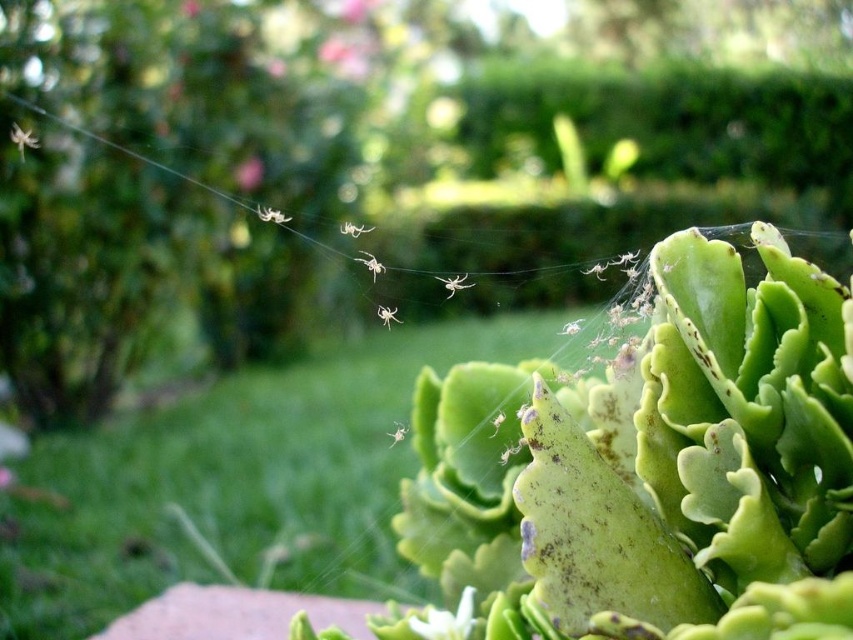
Is point (442, 636) closer to camera compared to point (247, 173)?

Yes, point (442, 636) is in front of point (247, 173).

Image resolution: width=853 pixels, height=640 pixels. Describe the element at coordinates (447, 620) in the screenshot. I see `white matte flower at lower center` at that location.

Where is `white matte flower at lower center`? white matte flower at lower center is located at coordinates (447, 620).

Is point (428, 628) closer to camera compared to point (277, 221)?

No, it is behind (277, 221).

The height and width of the screenshot is (640, 853). I want to click on white matte flower at lower center, so click(x=447, y=620).

Does point (413, 624) come farther from viewer compared to point (276, 211)?

No, (413, 624) is in front of (276, 211).

Locate an element on the screen. white matte flower at lower center is located at coordinates (447, 620).

Is green leafy plant at lower right positioned at the back of white matte spider at upper center?

Yes, it is.

Between green leafy plant at lower right and white matte spider at upper center, which one is positioned lower?

Positioned lower is green leafy plant at lower right.

This screenshot has height=640, width=853. What do you see at coordinates (242, 483) in the screenshot?
I see `green leafy plant at lower right` at bounding box center [242, 483].

You are a GUI agent. You are given a task and a screenshot of the screen. Output one action in this format:
    pyautogui.click(x=<x>, y=<y>)
    Task: Click on the green leafy plant at lower right
    The image size is (853, 640).
    Given the screenshot: What is the action you would take?
    pyautogui.click(x=242, y=483)